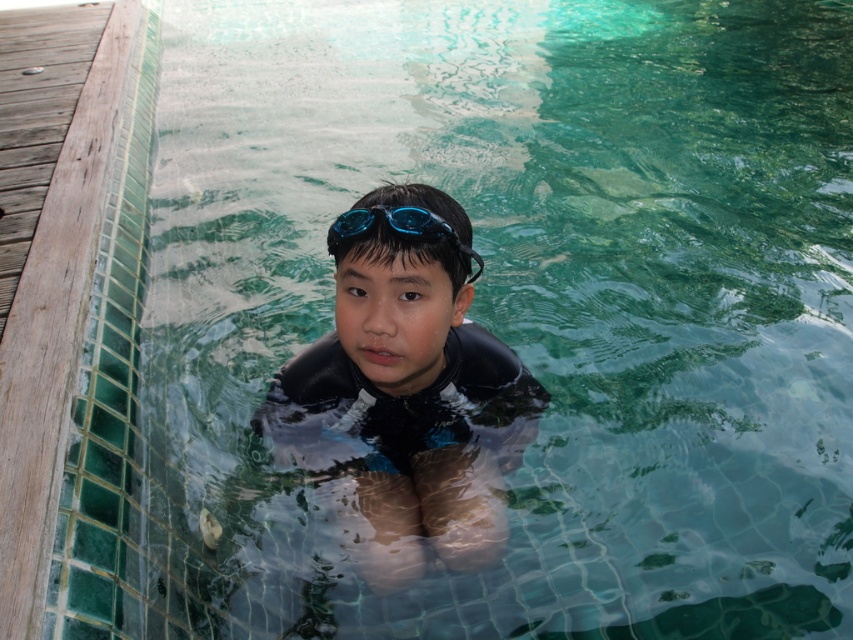
Question: Which point is closer to the camera?

Choices:
 (A) black matte wetsuit at center
 (B) blue matte swimming goggles at center
 (C) matte black swim vest at center

Answer: (B)

Question: Can you confirm if matte black swim vest at center is positioned below black matte wetsuit at center?

Choices:
 (A) yes
 (B) no

Answer: (B)

Question: Which of the following is the farthest from the observer?

Choices:
 (A) blue matte swimming goggles at center
 (B) matte black swim vest at center
 (C) black matte wetsuit at center

Answer: (C)

Question: Can you confirm if matte black swim vest at center is positioned to the left of black matte wetsuit at center?

Choices:
 (A) yes
 (B) no

Answer: (B)

Question: Is matte black swim vest at center to the left of blue matte swimming goggles at center from the viewer's perspective?

Choices:
 (A) yes
 (B) no

Answer: (A)

Question: Which object is positioned closest to the black matte wetsuit at center?

Choices:
 (A) matte black swim vest at center
 (B) blue matte swimming goggles at center

Answer: (A)